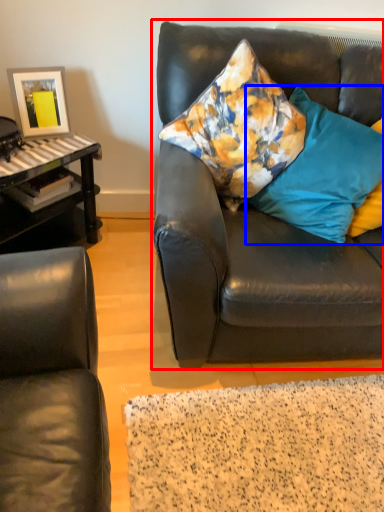
Question: Which of the following is the closest to the observer, studio couch (highlighted by a red box) or pillow (highlighted by a blue box)?

Choices:
 (A) studio couch
 (B) pillow

Answer: (A)